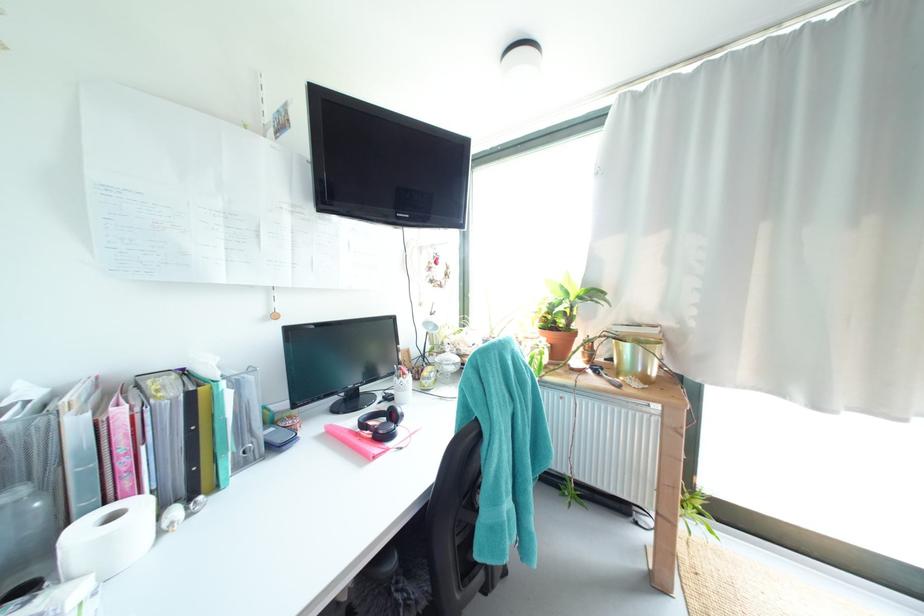
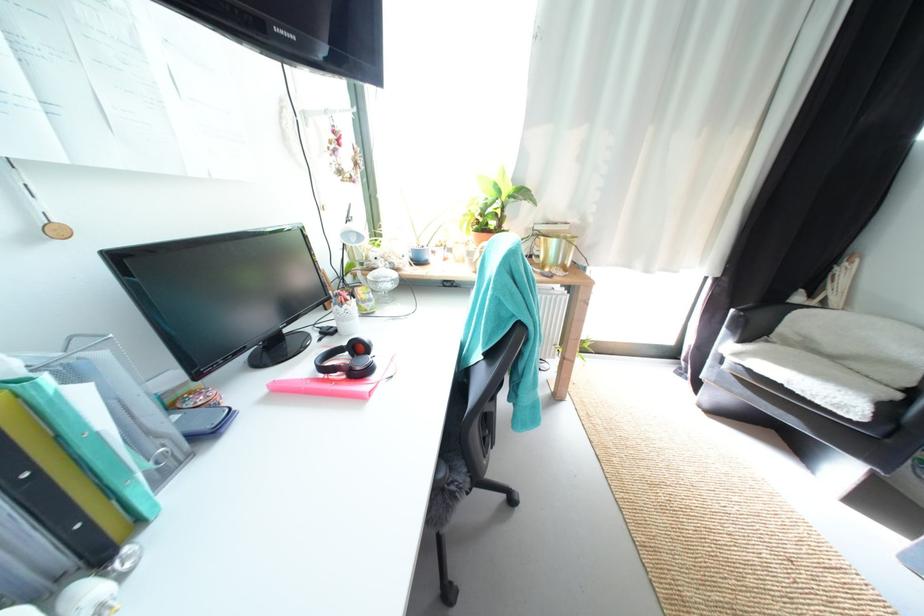
Where in the second image is the point corresponding to the point at 603,373 from the first image?

(535, 269)